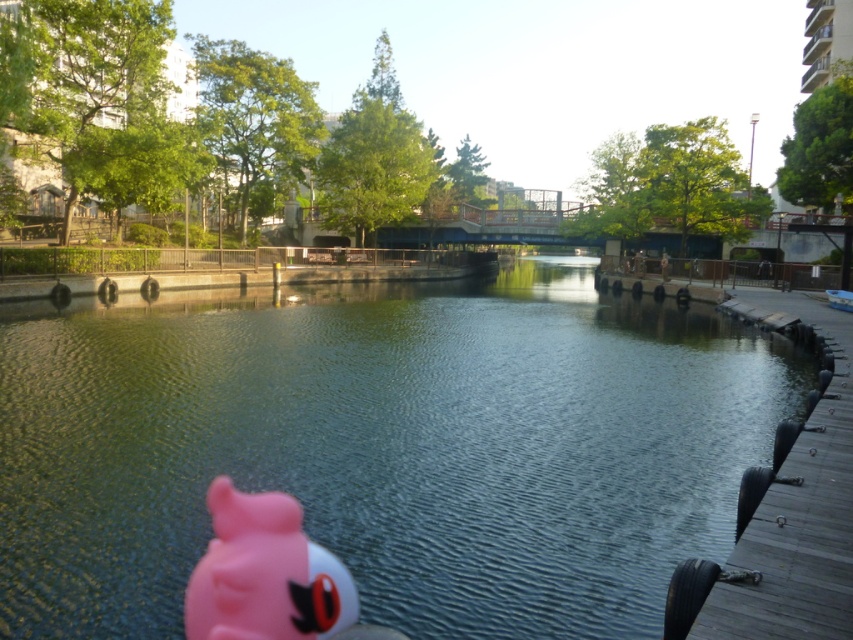
From the picture: Does dark gray wooden dock at right have a lesser height compared to pink rubber toy at lower left?

No.

Is point (770, 308) positioned in front of point (218, 611)?

No, (770, 308) is behind (218, 611).

Is point (830, 602) positioned in front of point (259, 572)?

That is False.

Identify the location of dark gray wooden dock at right. (798, 513).

Consider the image. Can you confirm if clear blue water at center is smaller than pink rubber toy at lower left?

No.

What are the coordinates of `clear blue water at center` in the screenshot? It's located at (384, 448).

Image resolution: width=853 pixels, height=640 pixels. I want to click on clear blue water at center, so click(384, 448).

Is clear blue water at center behind dark gray wooden dock at right?

That is True.

Who is more distant from viewer, (x=596, y=634) or (x=813, y=612)?

Positioned behind is point (x=596, y=634).

I want to click on clear blue water at center, so click(x=384, y=448).